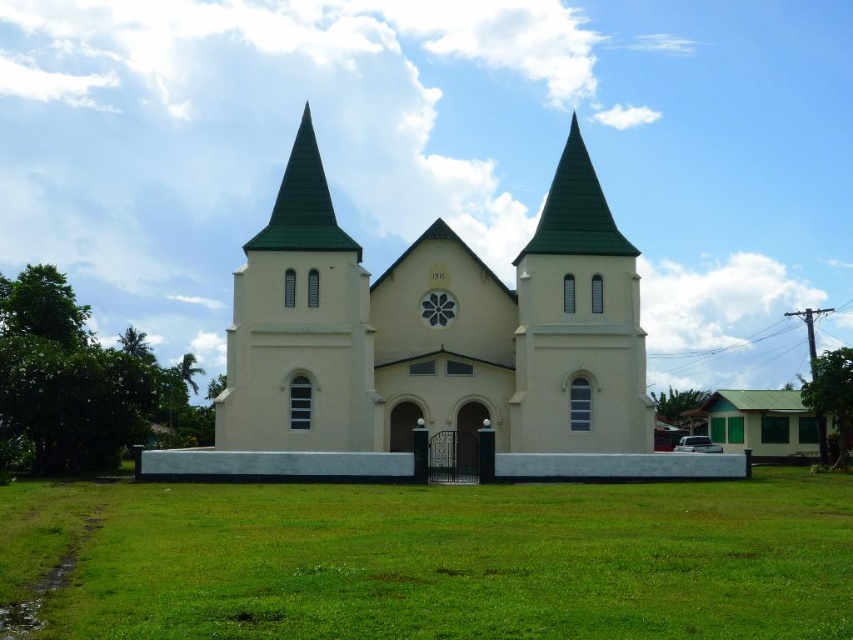
Can you confirm if green grass at center is smaller than beige concrete church at center?

Indeed, green grass at center has a smaller size compared to beige concrete church at center.

Between green grass at center and beige concrete church at center, which one is positioned lower?

green grass at center

Is point (260, 586) in front of point (450, 394)?

Yes, it is.

This screenshot has height=640, width=853. Find the location of `green grass at center`. green grass at center is located at coordinates (439, 560).